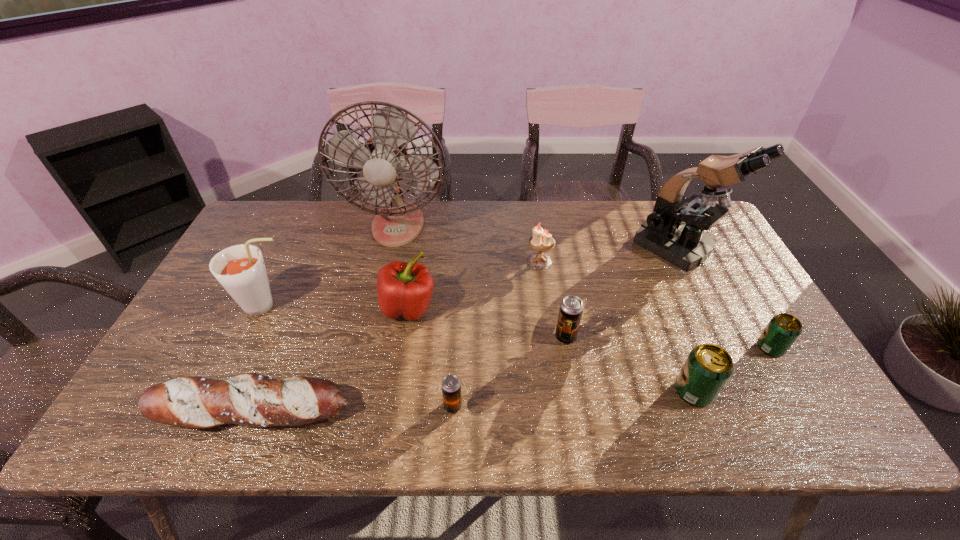
The image size is (960, 540). I want to click on free space between the microscope and the baguet, so click(466, 330).

Identify the location of free spot between the root beer and the baguet. (259, 359).

Identify the location of free space that is in between the bell pepper and the farther green beer can. (589, 328).

Locate an element on the screen. free spot between the microscope and the right black beer can is located at coordinates (621, 293).

Find the location of a particular element. empty space between the rightmost beer can and the candle holder is located at coordinates (655, 305).

Find the location of a particular element. empty space between the leftmost beer can and the farther black beer can is located at coordinates (509, 372).

Image resolution: width=960 pixels, height=540 pixels. In order to click on free spot between the pink bell pepper and the left green beer can in this screenshot , I will do `click(551, 349)`.

Select which object is the ninth closest to the root beer. Please provide its 2D coordinates. Your answer should be formatted as a tuple, i.e. [(x, y)], where the tuple contains the x and y coordinates of a point satisfying the conditions above.

[(783, 329)]

Choose which object is the seventh nearest neighbor to the fifth object from left to right. Please provide its 2D coordinates. Your answer should be formatted as a tuple, i.e. [(x, y)], where the tuple contains the x and y coordinates of a point satisfying the conditions above.

[(384, 156)]

The width and height of the screenshot is (960, 540). Identify the location of the third closest beer can to the second beer can from right to left. (451, 386).